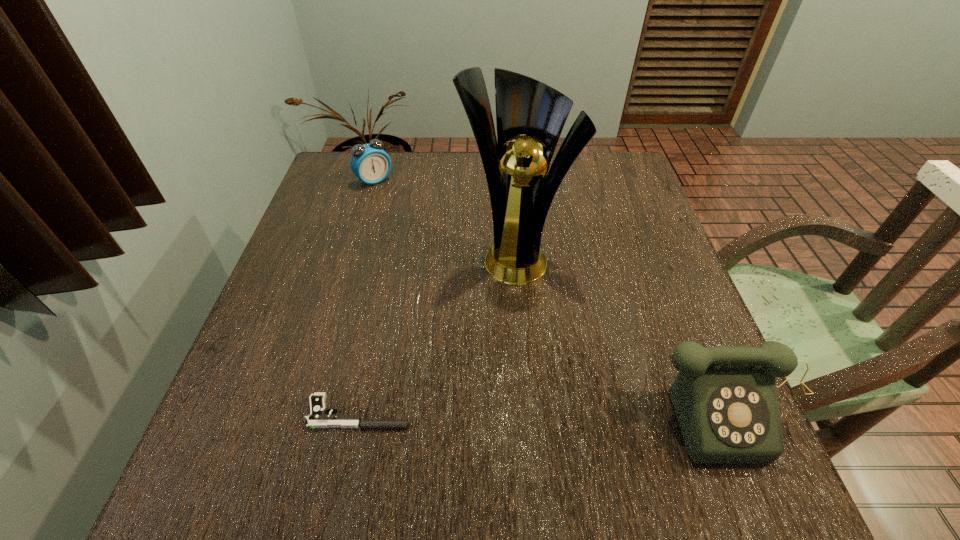
This screenshot has height=540, width=960. I want to click on free space that satisfies the following two spatial constraints: 1. on the front side of the alarm clock; 2. on the front-facing side of the pistol, so click(x=306, y=413).

Locate an element on the screen. vacant space that satisfies the following two spatial constraints: 1. on the front side of the shortest object; 2. on the front-facing side of the alarm clock is located at coordinates (306, 413).